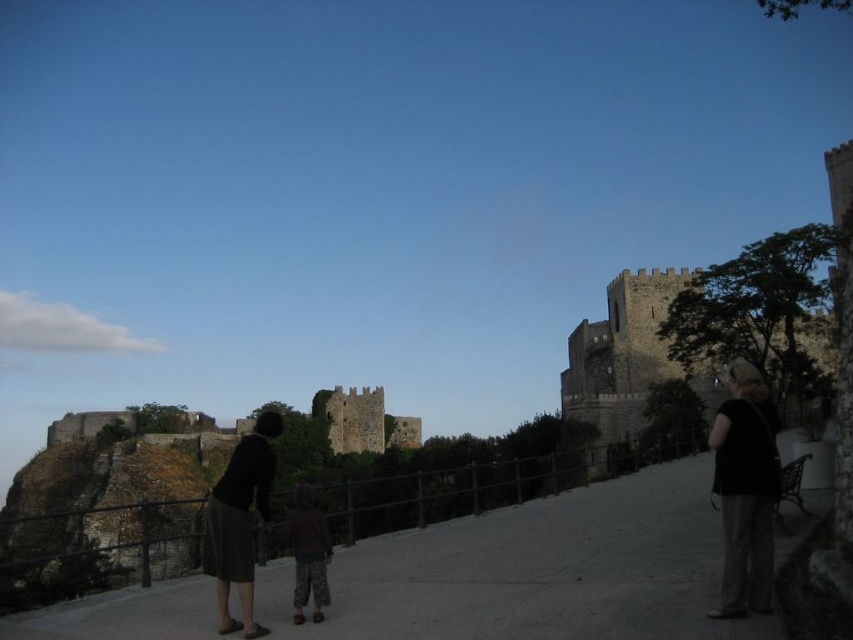
The height and width of the screenshot is (640, 853). Describe the element at coordinates (627, 358) in the screenshot. I see `dark stone castle at upper center` at that location.

How far apart are dark stone castle at upper center and dark gray skirt at lower center?

They are 190.78 feet apart.

Who is more forward, (662, 353) or (225, 472)?

Point (662, 353) is in front.

Find the location of a particular element. dark stone castle at upper center is located at coordinates (627, 358).

Can you confirm if dark stone castle at upper center is positioned to the left of black fabric at right?

In fact, dark stone castle at upper center is to the right of black fabric at right.

The width and height of the screenshot is (853, 640). Identify the location of dark stone castle at upper center. (627, 358).

Between point (576, 412) and point (740, 410), which one is positioned behind?

The point (576, 412) is more distant.

The width and height of the screenshot is (853, 640). What are the coordinates of `dark stone castle at upper center` in the screenshot? It's located at (627, 358).

How distant is dark concrete path at center from black fabric at right?

The distance of dark concrete path at center from black fabric at right is 62.42 feet.

Between dark concrete path at center and black fabric at right, which one is positioned lower?

dark concrete path at center is lower down.

Which is in front, point (430, 545) or point (744, 609)?

Point (744, 609)

The height and width of the screenshot is (640, 853). Identify the location of dark concrete path at center. (535, 570).